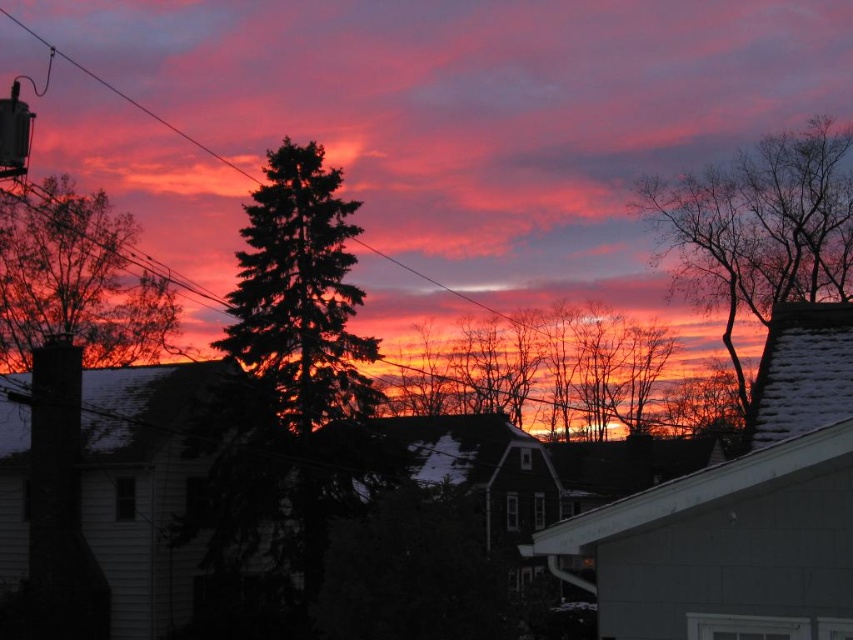
You are an artist painting this sunset scene. You want to add details to the bare branches at upper right and the silhouette evergreen tree at left. Which object should you paint first to ensure proper layering?

You should paint the bare branches at upper right first because it is in front of the silhouette evergreen tree at left, so painting it first will allow the evergreen tree to be layered behind it properly.